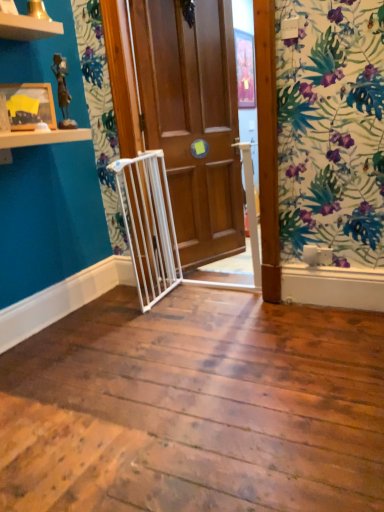
Question: Is wooden picture frame at upper left taller than wooden door at center?

Choices:
 (A) yes
 (B) no

Answer: (B)

Question: Is wooden picture frame at upper left further to camera compared to wooden door at center?

Choices:
 (A) no
 (B) yes

Answer: (A)

Question: Is wooden picture frame at upper left turned away from wooden door at center?

Choices:
 (A) yes
 (B) no

Answer: (B)

Question: From a real-world perspective, does wooden picture frame at upper left sit lower than wooden door at center?

Choices:
 (A) yes
 (B) no

Answer: (B)

Question: From the image's perspective, does wooden picture frame at upper left appear lower than wooden door at center?

Choices:
 (A) no
 (B) yes

Answer: (B)

Question: Does wooden picture frame at upper left have a larger size compared to wooden door at center?

Choices:
 (A) yes
 (B) no

Answer: (B)

Question: Considering the relative sizes of wooden door at center and wooden picture frame at upper left in the image provided, is wooden door at center wider than wooden picture frame at upper left?

Choices:
 (A) yes
 (B) no

Answer: (A)

Question: From the image's perspective, is wooden door at center on wooden picture frame at upper left?

Choices:
 (A) no
 (B) yes

Answer: (B)

Question: Is wooden picture frame at upper left at the back of wooden door at center?

Choices:
 (A) no
 (B) yes

Answer: (A)

Question: Does wooden door at center turn towards wooden picture frame at upper left?

Choices:
 (A) yes
 (B) no

Answer: (B)

Question: Is wooden door at center closer to the viewer compared to wooden picture frame at upper left?

Choices:
 (A) yes
 (B) no

Answer: (B)

Question: Is wooden door at center to the right of wooden picture frame at upper left from the viewer's perspective?

Choices:
 (A) yes
 (B) no

Answer: (A)

Question: In terms of width, does wooden door at center look wider or thinner when compared to wooden picture frame at upper left?

Choices:
 (A) wide
 (B) thin

Answer: (A)